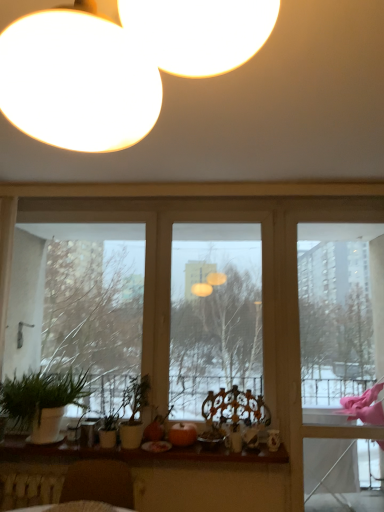
Where is `blank space above pink fabric at right (from a real-world perspective)`? The height and width of the screenshot is (512, 384). blank space above pink fabric at right (from a real-world perspective) is located at coordinates (335, 209).